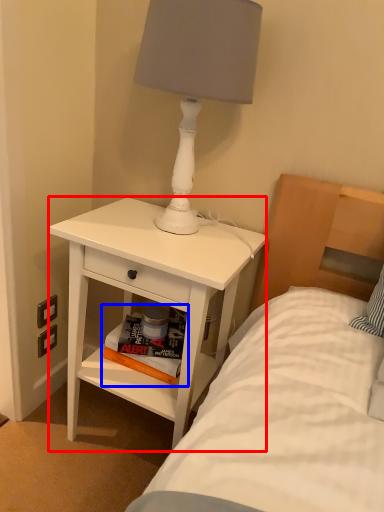
Question: Which point is closer to the camera, nightstand (highlighted by a red box) or magazine (highlighted by a blue box)?

Choices:
 (A) nightstand
 (B) magazine

Answer: (A)